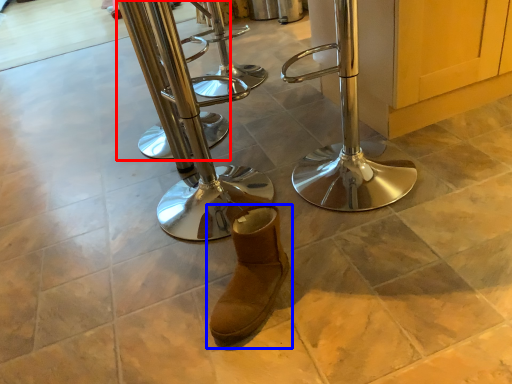
Question: Which of the following is the closest to the observer, step stool (highlighted by a red box) or footwear (highlighted by a blue box)?

Choices:
 (A) step stool
 (B) footwear

Answer: (B)